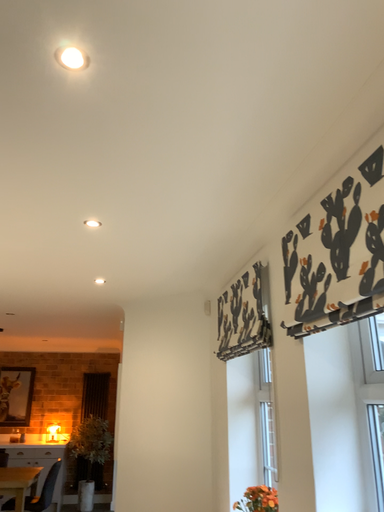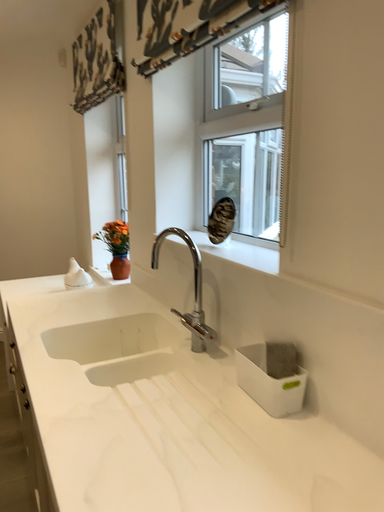
Question: Which way did the camera rotate in the video?

Choices:
 (A) rotated right
 (B) rotated left

Answer: (A)